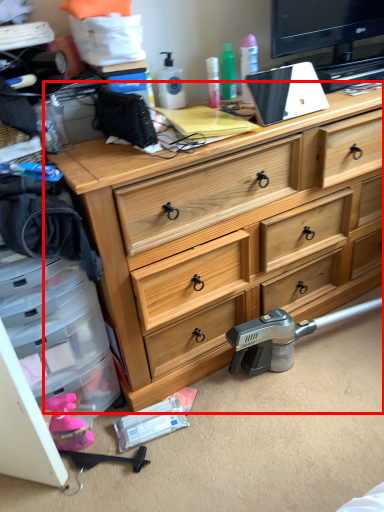
Question: Where is chest of drawers (annotated by the red box) located in relation to weapon in the image?

Choices:
 (A) right
 (B) left

Answer: (A)